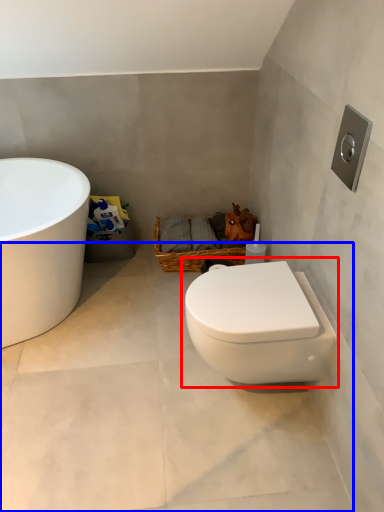
Question: Which point is closer to the camera, toilet (highlighted by a red box) or concrete (highlighted by a blue box)?

Choices:
 (A) toilet
 (B) concrete

Answer: (B)